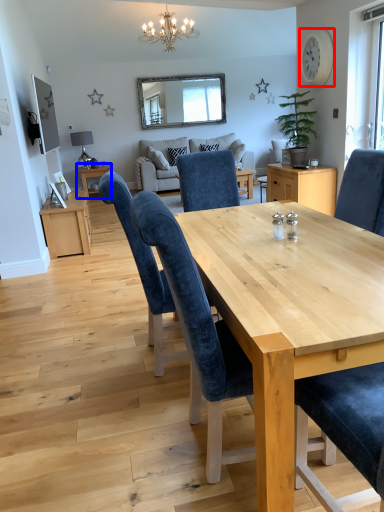
Question: Among these objects, which one is farthest to the camera, clock (highlighted by a red box) or table (highlighted by a blue box)?

Choices:
 (A) clock
 (B) table

Answer: (B)